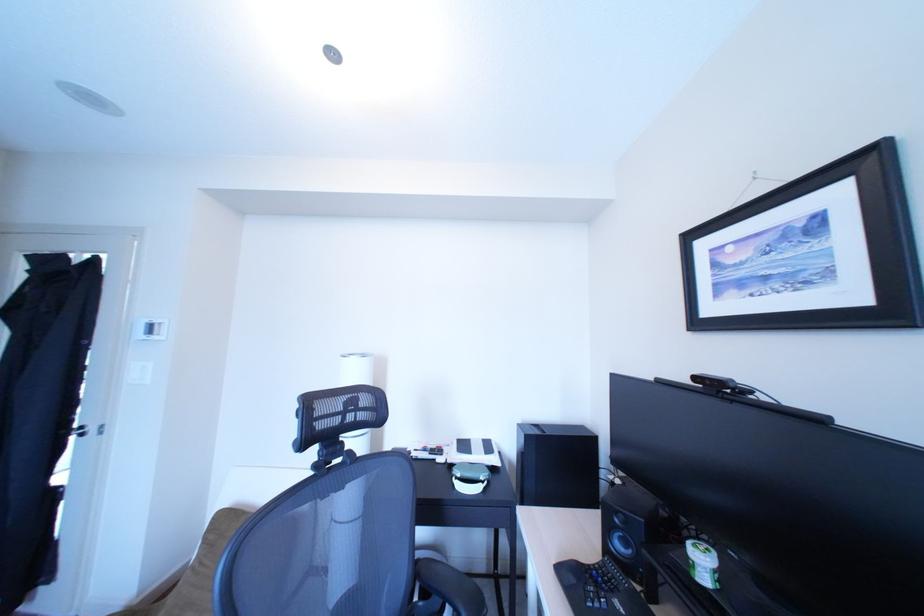
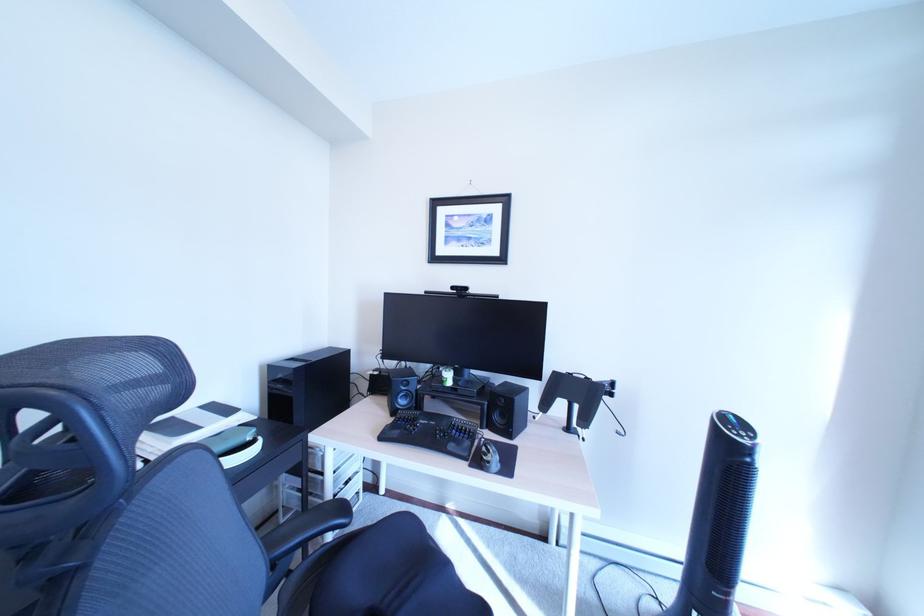
Question: Based on the continuous images, in which direction is the camera rotating? Reply with the corresponding letter.

Choices:
 (A) Left
 (B) Right
 (C) Up
 (D) Down

Answer: (B)